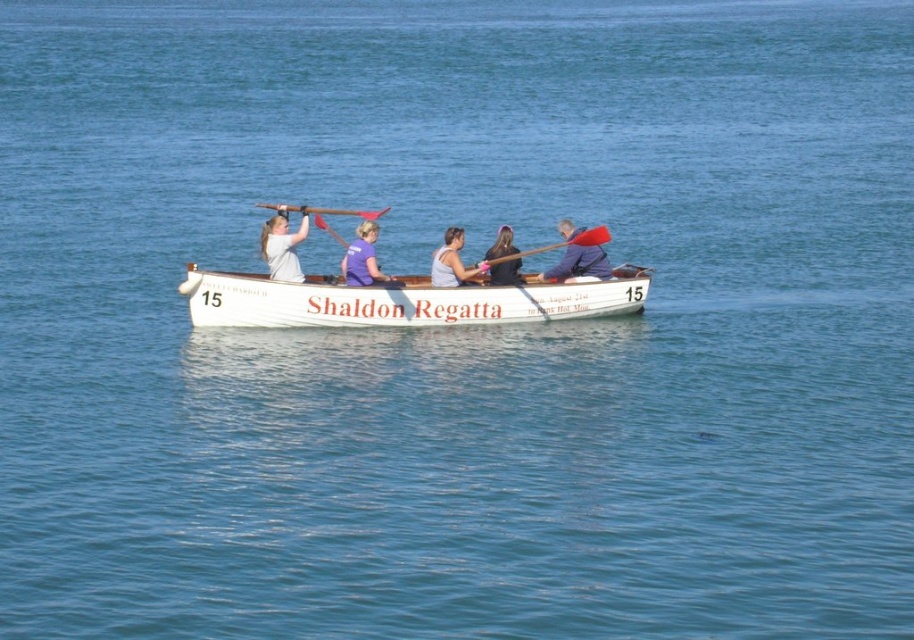
Question: Is purple fabric shirt at center to the left of red wood paddle at center from the viewer's perspective?

Choices:
 (A) no
 (B) yes

Answer: (B)

Question: Can you confirm if blue fabric jacket at center is positioned below red wood paddle at center?

Choices:
 (A) yes
 (B) no

Answer: (A)

Question: Considering the real-world distances, which object is farthest from the matte gray tank top at center?

Choices:
 (A) red wood paddle at center
 (B) brushed metal paddle at upper center
 (C) blue fabric jacket at center
 (D) white polished wood canoe at center

Answer: (B)

Question: Considering the relative positions of white matte shirt at upper left and purple fabric shirt at center in the image provided, where is white matte shirt at upper left located with respect to purple fabric shirt at center?

Choices:
 (A) left
 (B) right

Answer: (A)

Question: Which of the following is the farthest from the observer?

Choices:
 (A) matte gray tank top at center
 (B) purple fabric shirt at center
 (C) brushed metal paddle at upper center
 (D) red wood paddle at center

Answer: (C)

Question: Which point appears closest to the camera in this image?

Choices:
 (A) (254, 204)
 (B) (479, 288)
 (C) (562, 272)
 (D) (287, 268)

Answer: (B)